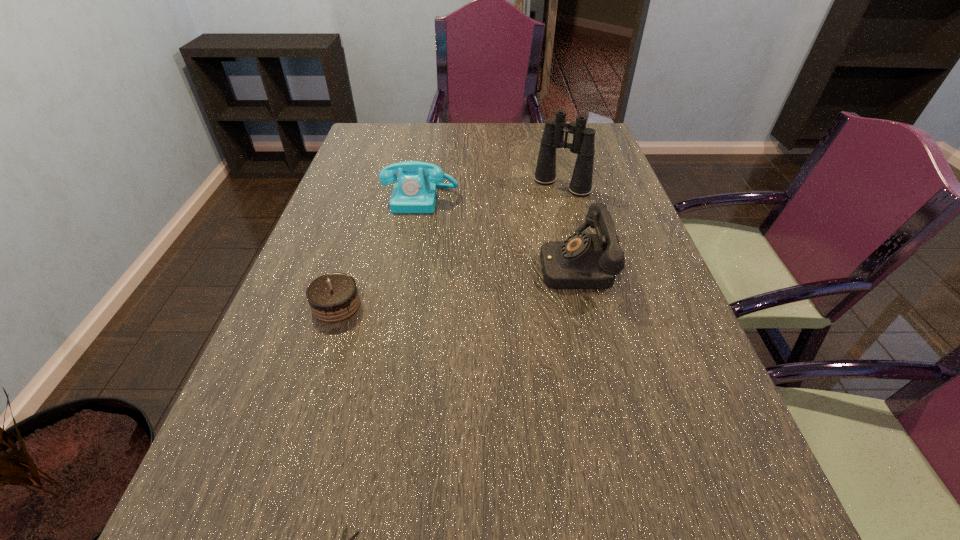
The height and width of the screenshot is (540, 960). Find the location of `free space between the left telephone and the binoculars`. free space between the left telephone and the binoculars is located at coordinates (492, 192).

Identify the location of vacant space in between the chocolate cake and the left telephone. (378, 252).

This screenshot has width=960, height=540. Identify the location of vacant region between the fourth tallest object and the shorter telephone. (x=378, y=252).

Locate an element on the screen. The height and width of the screenshot is (540, 960). unoccupied area between the tallest object and the shorter telephone is located at coordinates (492, 192).

Where is `unoccupied area between the third shortest object and the tallest object`? unoccupied area between the third shortest object and the tallest object is located at coordinates point(492,192).

Identify the location of object that is the third closest to the nearest object. pos(415,192).

Select which object is the fourth closest to the shears. Please provide its 2D coordinates. Your answer should be formatted as a tuple, i.e. [(x, y)], where the tuple contains the x and y coordinates of a point satisfying the conditions above.

[(583, 139)]